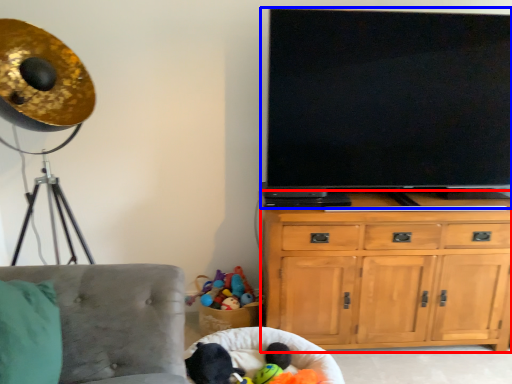
Question: Which point is closer to the camera, cabinetry (highlighted by a red box) or television (highlighted by a blue box)?

Choices:
 (A) cabinetry
 (B) television

Answer: (B)